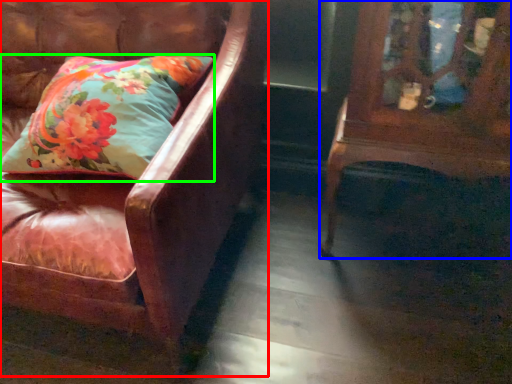
Question: Based on their relative distances, which object is nearer to chair (highlighted by a red box)? Choose from furniture (highlighted by a blue box) and pillow (highlighted by a green box).

Choices:
 (A) furniture
 (B) pillow

Answer: (B)